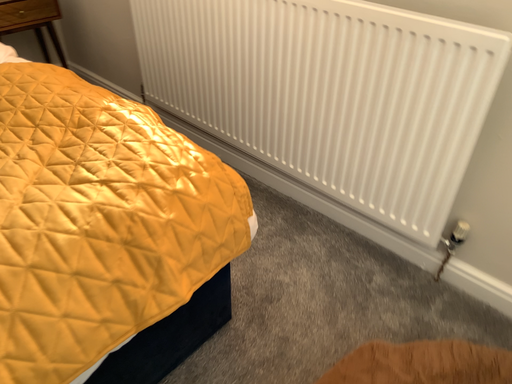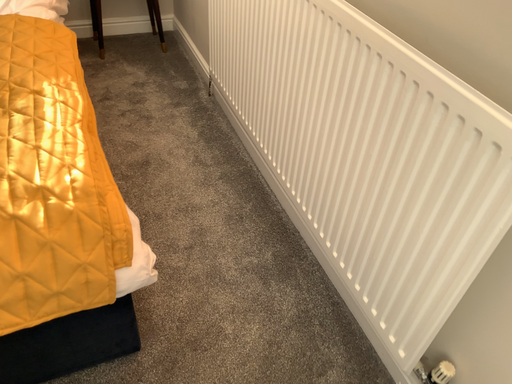
Question: Which way did the camera rotate in the video?

Choices:
 (A) rotated right
 (B) rotated left

Answer: (B)